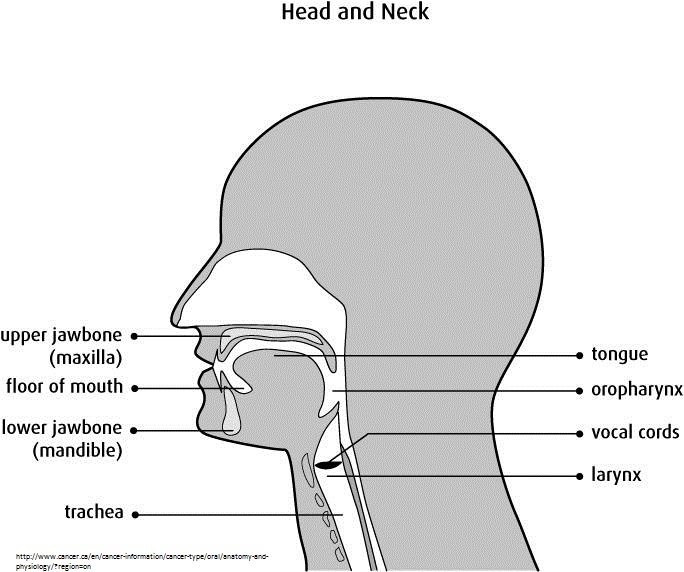
Where is `poster`? The height and width of the screenshot is (572, 684). poster is located at coordinates (412, 331).